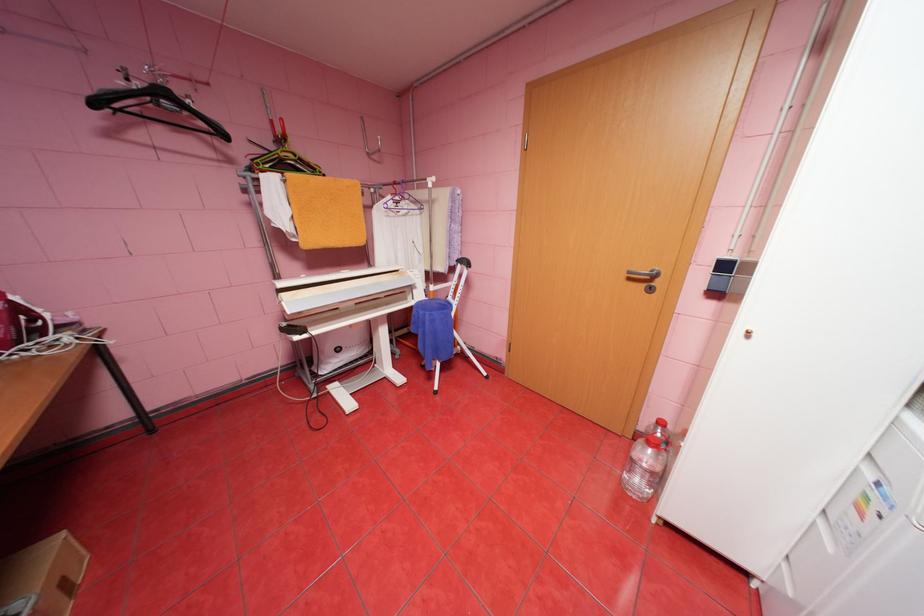
Where would you lift the ironing press handle? Please return your answer as a coordinate pair (x, y).

(18, 305)